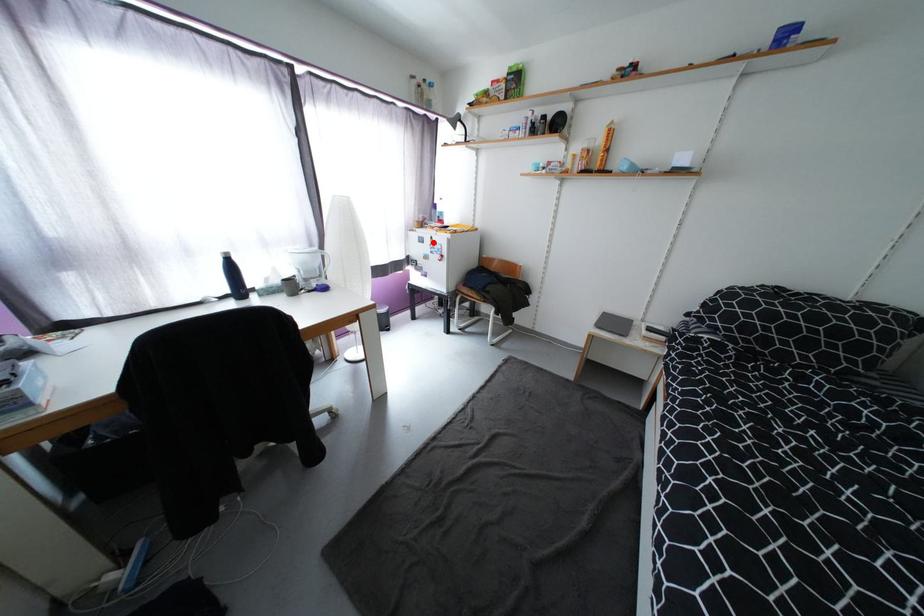
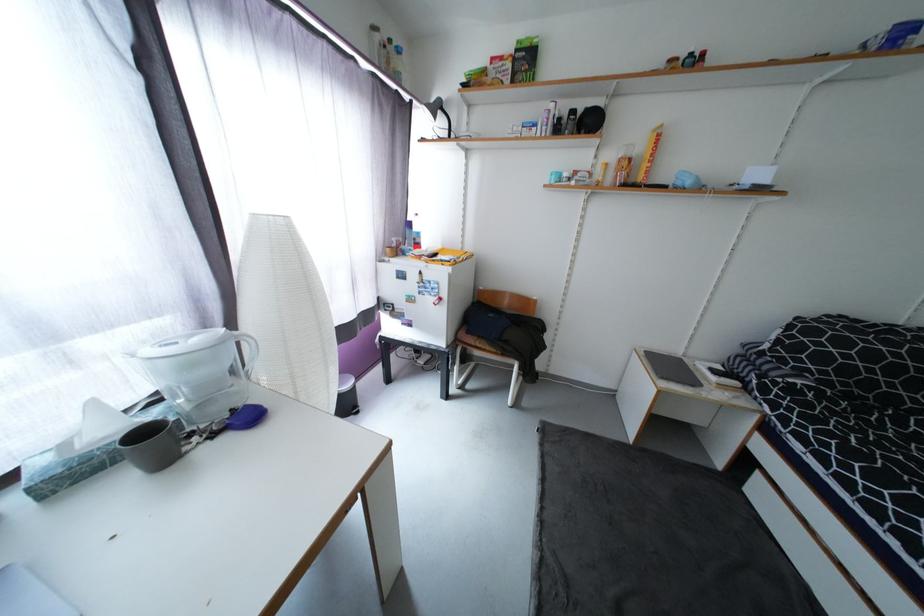
Question: I am providing you with two images of the same scene from different viewpoints. A red point is marked on the first image. At the location where the point appears in image 1, is it still visible in image 2?

Choices:
 (A) Yes
 (B) No

Answer: (A)